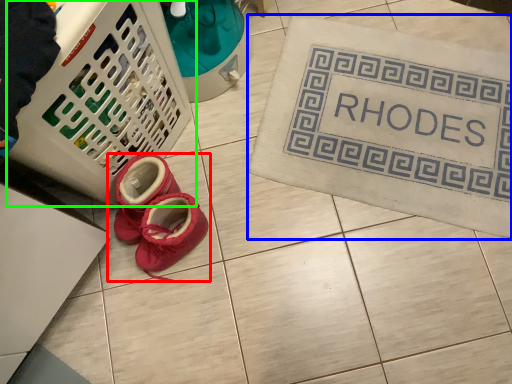
Question: Which object is positioned farthest from footwear (highlighted by a red box)? Select from bath mat (highlighted by a blue box) and basket (highlighted by a green box).

Choices:
 (A) bath mat
 (B) basket

Answer: (A)